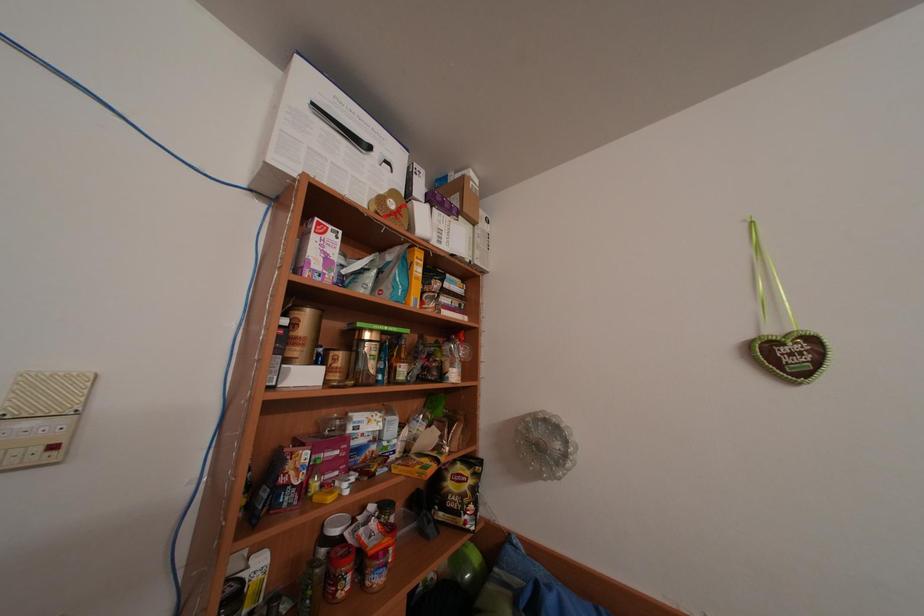
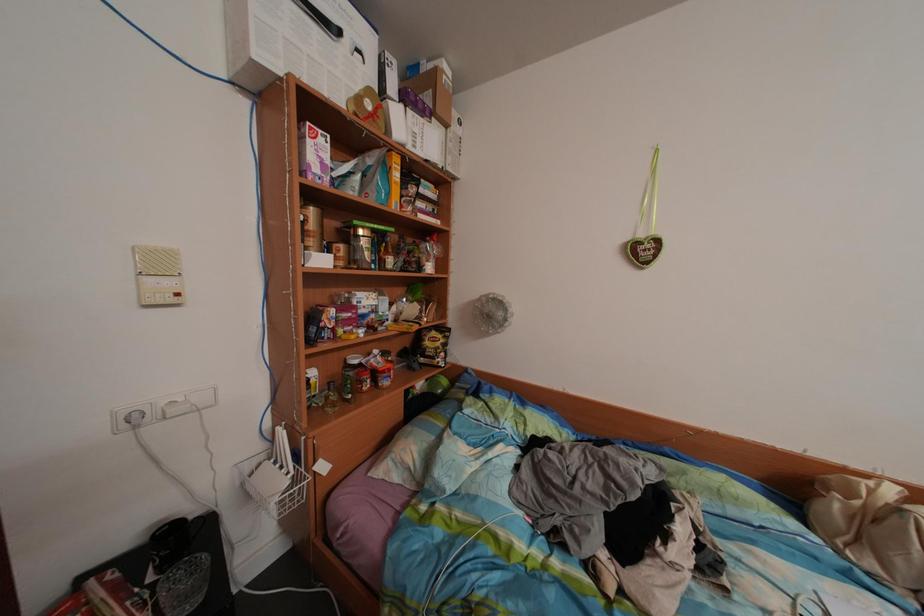
Question: In a continuous first-person perspective shot, in which direction is the camera moving?

Choices:
 (A) Left
 (B) Right
 (C) Forward
 (D) Backward

Answer: (D)